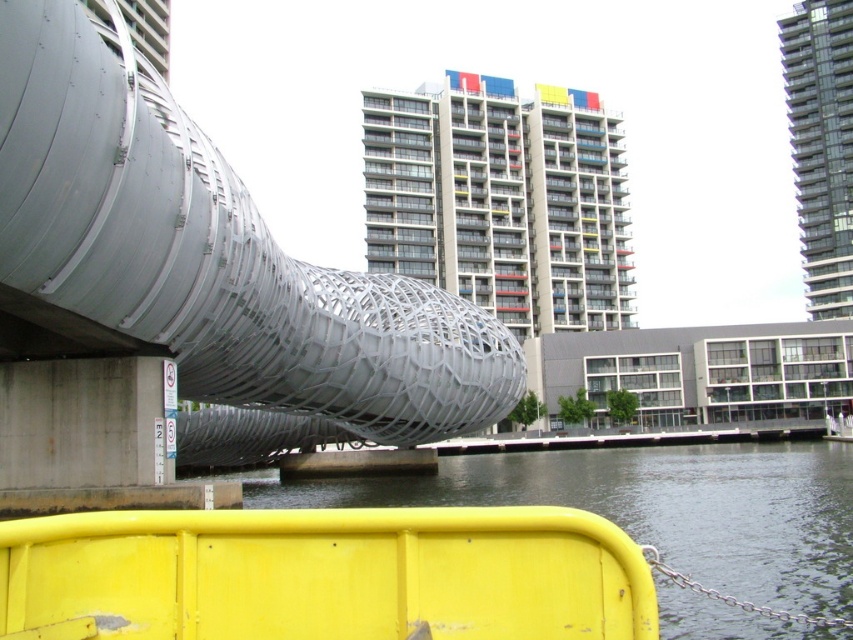
You are a maintenance worker inspecting the waterfront area. You notice two yellow barriers at the lower center of the scene. Which one is shorter in height between the yellow matte rail at lower center and the yellow plastic barrier at lower center?

The yellow matte rail at lower center is not as tall as the yellow plastic barrier at lower center, so the yellow matte rail at lower center is shorter in height.

You are a maintenance worker assigned to inspect the area between the yellow matte rail at lower center and the yellow plastic barrier at lower center. Your inspection equipment requires a minimum of 80 feet of space to operate safely. Can you safely use your equipment in this area?

The distance between the yellow matte rail at lower center and the yellow plastic barrier at lower center is 88.32 feet, which exceeds the required 80 feet. Therefore, you can safely use your equipment in this area.

You are standing at the yellow metal railing and want to take a photo of the curved bridge. You notice two points marked in the scene, point (468,429) and point (643,595). Which point should you focus on to ensure the curved bridge is in the foreground of your photo?

You should focus on point (468,429) because it is closer to the camera than point (643,595). This will place the curved bridge in the foreground of your photo.